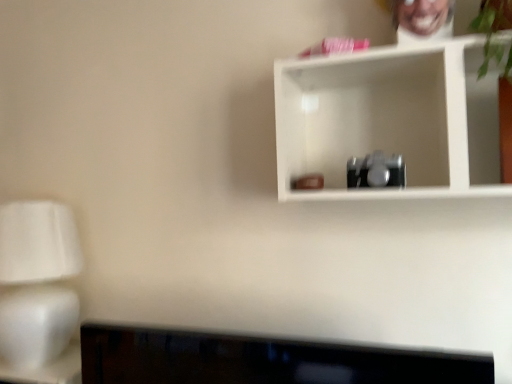
Question: From a real-world perspective, is white matte shelf at upper center positioned above or below white matte table lamp at left?

Choices:
 (A) below
 (B) above

Answer: (B)

Question: Relative to white matte table lamp at left, is white matte shelf at upper center in front or behind?

Choices:
 (A) front
 (B) behind

Answer: (A)

Question: Does point (471, 77) appear closer or farther from the camera than point (28, 334)?

Choices:
 (A) closer
 (B) farther

Answer: (A)

Question: From the image's perspective, is white matte table lamp at left above or below white matte shelf at upper center?

Choices:
 (A) above
 (B) below

Answer: (B)

Question: Considering the positions of white matte table lamp at left and white matte shelf at upper center in the image, is white matte table lamp at left bigger or smaller than white matte shelf at upper center?

Choices:
 (A) small
 (B) big

Answer: (B)

Question: In the image, is white matte table lamp at left positioned in front of or behind white matte shelf at upper center?

Choices:
 (A) front
 (B) behind

Answer: (B)

Question: Is white matte table lamp at left situated inside white matte shelf at upper center or outside?

Choices:
 (A) outside
 (B) inside

Answer: (A)